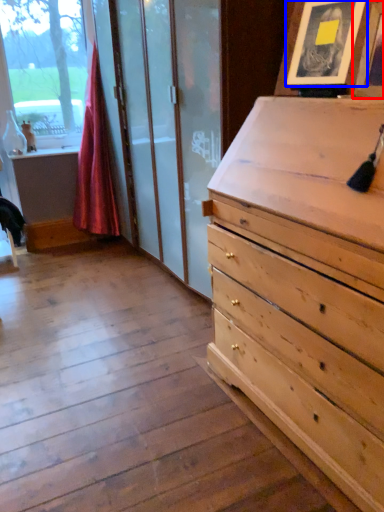
Question: Which object appears closest to the camera in this image, picture frame (highlighted by a red box) or picture frame (highlighted by a blue box)?

Choices:
 (A) picture frame
 (B) picture frame

Answer: (A)